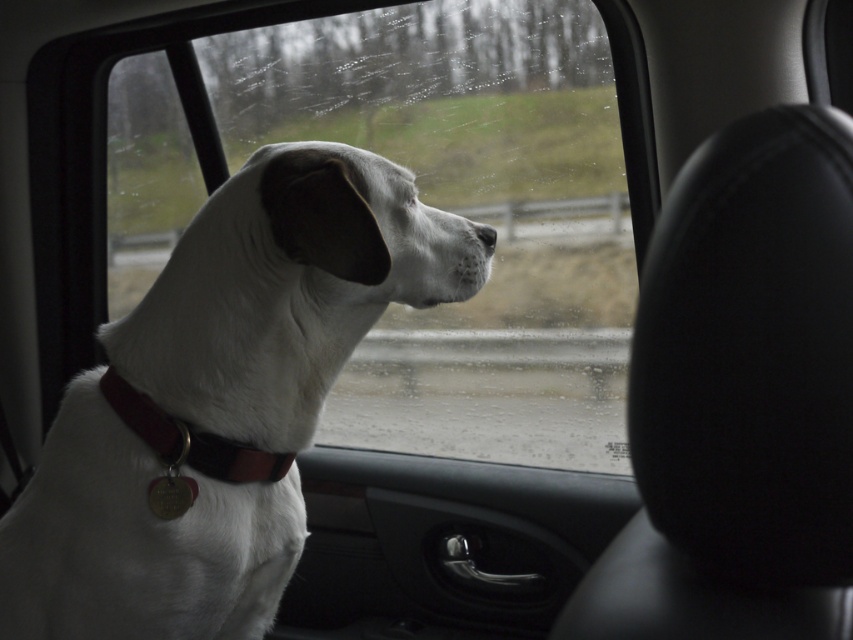
Question: Can you confirm if white matte dog head at center is positioned to the left of black matte nose at center?

Choices:
 (A) no
 (B) yes

Answer: (B)

Question: Can you confirm if black leather headrest at right is positioned to the right of white matte dog head at center?

Choices:
 (A) no
 (B) yes

Answer: (B)

Question: Which of these objects is positioned farthest from the brown leather collar at center?

Choices:
 (A) white matte dog head at center
 (B) black matte nose at center
 (C) black leather headrest at right

Answer: (C)

Question: Which point is closer to the camera?

Choices:
 (A) white matte dog at center
 (B) black matte nose at center

Answer: (A)

Question: Which object is positioned farthest from the brown leather collar at center?

Choices:
 (A) white matte dog head at center
 (B) white matte dog at center
 (C) transparent glass window at center
 (D) black leather headrest at right

Answer: (C)

Question: Is the position of white matte dog at center less distant than that of black matte nose at center?

Choices:
 (A) yes
 (B) no

Answer: (A)